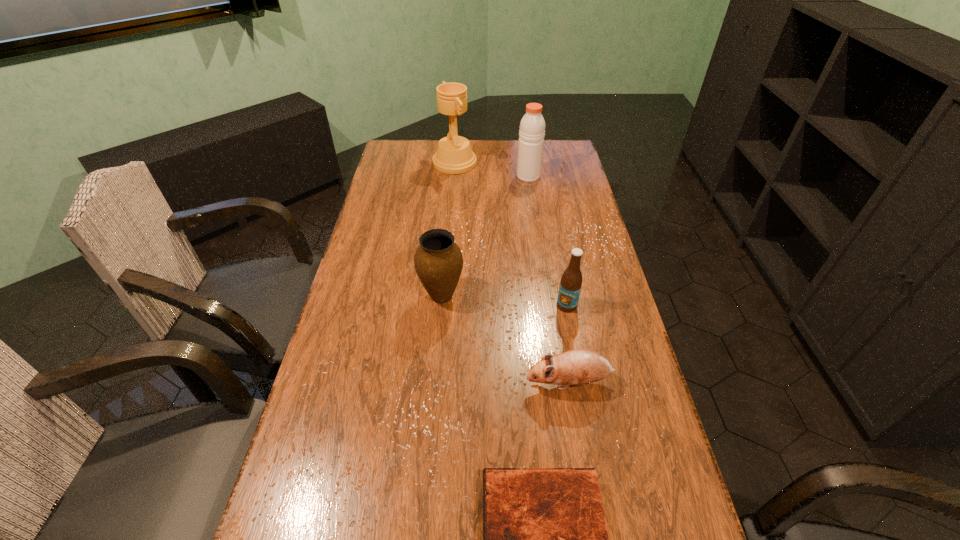
At what (x,y) coordinates should I click in order to perform the action: click on free region located at the face of the fifth tallest object. Please return your answer as a coordinate pair (x, y). This screenshot has width=960, height=540. Looking at the image, I should click on (457, 382).

Where is `free location located at the face of the fifth tallest object`? Image resolution: width=960 pixels, height=540 pixels. free location located at the face of the fifth tallest object is located at coordinates point(457,382).

Locate an element on the screen. Image resolution: width=960 pixels, height=540 pixels. blank area located at the face of the fifth tallest object is located at coordinates (496, 382).

This screenshot has width=960, height=540. Find the location of `object present at the far edge`. object present at the far edge is located at coordinates (454, 155).

What are the coordinates of `shaker located at the right edge` in the screenshot? It's located at (532, 127).

In order to click on beer bottle situated at the right edge in this screenshot , I will do `click(571, 281)`.

Find the location of `hamster that is at the right edge`. hamster that is at the right edge is located at coordinates (578, 367).

Where is `vacant space at the far edge`? This screenshot has height=540, width=960. vacant space at the far edge is located at coordinates (478, 157).

Image resolution: width=960 pixels, height=540 pixels. In order to click on free spot at the left edge of the desktop in this screenshot , I will do point(384,221).

Find the location of a particular element. This screenshot has width=960, height=540. blank space at the right edge of the desktop is located at coordinates (607, 270).